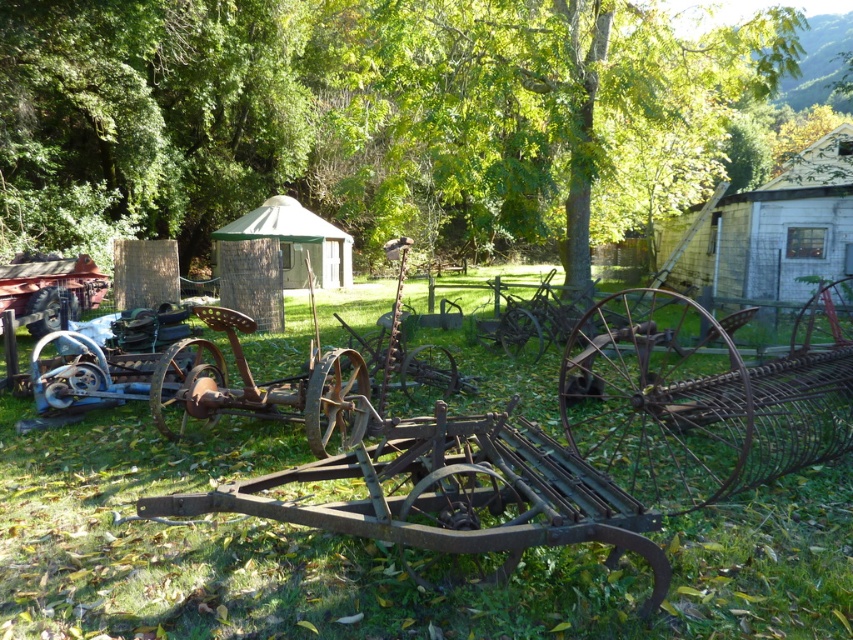
You are a visitor exploring the countryside scene and want to take a photo of the green rusty grass at center and the white brick hut at upper right. Which object should you focus on first if you want to capture both in the same frame without moving your camera?

You should focus on the white brick hut at upper right first because it is taller than the green rusty grass at center, allowing both to be in the frame when starting with the taller object.

You are standing in the countryside scene and want to walk from the point at coordinates point [430,236] to the point at coordinates point [247,212]. Which direction should you face to move towards the second point?

You should face downward because point [430,236] is further to the viewer than point [247,212], so moving towards the latter requires going in the direction away from the viewer.

In the rural setting, there is a green leafy tree at center and a green canvas tent at center. Which object is wider?

The green leafy tree at center is wider than the green canvas tent at center.